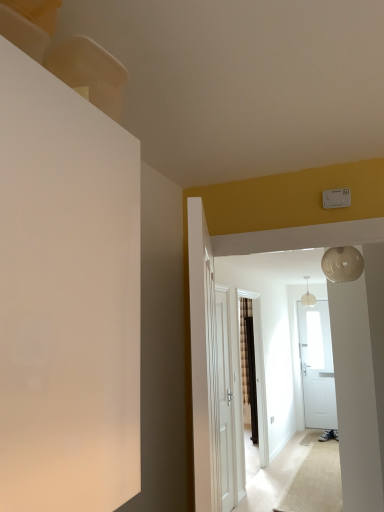
This screenshot has width=384, height=512. I want to click on white wooden door at center, the second door from the left, so click(x=225, y=400).

Measure the distance between white wooden door at center, the first door from the front, and camera.

white wooden door at center, the first door from the front, and camera are 11.24 feet apart from each other.

The height and width of the screenshot is (512, 384). Find the location of `pearl white glass globe at upper right`. pearl white glass globe at upper right is located at coordinates (342, 264).

How far apart are white wooden door at center, which ranks as the 1th door in back-to-front order, and pearl white glass globe at upper center?

3.07 meters.

Does white wooden door at center, which ranks as the 1th door in back-to-front order, have a smaller size compared to pearl white glass globe at upper center?

No, white wooden door at center, which ranks as the 1th door in back-to-front order, is not smaller than pearl white glass globe at upper center.

Find the location of a particular element. This screenshot has width=384, height=512. the 2nd door located beneath the pearl white glass globe at upper center (from a real-world perspective) is located at coordinates (225, 400).

From their relative heights in the image, would you say white wooden door at center, which ranks as the 1th door in back-to-front order, is taller or shorter than pearl white glass globe at upper center?

white wooden door at center, which ranks as the 1th door in back-to-front order, is taller than pearl white glass globe at upper center.

Considering the relative sizes of pearl white glass globe at upper right and white wooden door at center, which ranks as the second door in back-to-front order, in the image provided, is pearl white glass globe at upper right shorter than white wooden door at center, which ranks as the second door in back-to-front order,?

Correct, pearl white glass globe at upper right is not as tall as white wooden door at center, which ranks as the second door in back-to-front order.

Considering the relative positions of pearl white glass globe at upper right and white wooden door at center, placed as the second door when sorted from right to left, in the image provided, is pearl white glass globe at upper right to the right of white wooden door at center, placed as the second door when sorted from right to left, from the viewer's perspective?

Correct, you'll find pearl white glass globe at upper right to the right of white wooden door at center, placed as the second door when sorted from right to left.

Does pearl white glass globe at upper right turn towards white wooden door at center, which ranks as the second door in back-to-front order?

No, pearl white glass globe at upper right is not oriented towards white wooden door at center, which ranks as the second door in back-to-front order.

How far apart are pearl white glass globe at upper right and white wooden door at center, placed as the second door when sorted from right to left?

pearl white glass globe at upper right and white wooden door at center, placed as the second door when sorted from right to left, are 5.67 feet apart.

Considering the relative sizes of pearl white glass globe at upper center and white wooden door at center, the 1th door when ordered from left to right, in the image provided, is pearl white glass globe at upper center wider than white wooden door at center, the 1th door when ordered from left to right,?

Incorrect, the width of pearl white glass globe at upper center does not surpass that of white wooden door at center, the 1th door when ordered from left to right.

Is pearl white glass globe at upper center bigger than white wooden door at center, placed as the second door when sorted from right to left?

Actually, pearl white glass globe at upper center might be smaller than white wooden door at center, placed as the second door when sorted from right to left.

Is pearl white glass globe at upper center completely or partially outside of white wooden door at center, the 1th door when ordered from left to right?

Absolutely, pearl white glass globe at upper center is external to white wooden door at center, the 1th door when ordered from left to right.

Is pearl white glass globe at upper center far away from white wooden door at center, which ranks as the second door in back-to-front order?

Indeed, pearl white glass globe at upper center is not near white wooden door at center, which ranks as the second door in back-to-front order.

Does pearl white glass globe at upper center turn towards white wooden door at center, which ranks as the 1th door in back-to-front order?

No.

From a real-world perspective, is pearl white glass globe at upper center above or below white wooden door at center, the 2th door viewed from the front?

From a real-world perspective, pearl white glass globe at upper center is physically above white wooden door at center, the 2th door viewed from the front.

Does pearl white glass globe at upper center touch white wooden door at center, marked as the 1th door in a right-to-left arrangement?

There is a gap between pearl white glass globe at upper center and white wooden door at center, marked as the 1th door in a right-to-left arrangement.

From the image's perspective, which is above, white wooden door at center, placed as the second door when sorted from right to left, or pearl white glass globe at upper right?

pearl white glass globe at upper right, from the image's perspective.

From a real-world perspective, which object rests below the other?

white wooden door at center, the 1th door when ordered from left to right, is physically lower.

Is white wooden door at center, placed as the second door when sorted from right to left, taller or shorter than pearl white glass globe at upper right?

white wooden door at center, placed as the second door when sorted from right to left, is taller than pearl white glass globe at upper right.

What are the coordinates of `lamp located above the white wooden door at center, the first door from the front (from the image's perspective)` in the screenshot? It's located at (342, 264).

Does pearl white glass globe at upper right appear on the right side of pearl white glass globe at upper center?

No.

Can pearl white glass globe at upper center be found inside pearl white glass globe at upper right?

No, pearl white glass globe at upper center is located outside of pearl white glass globe at upper right.

Is pearl white glass globe at upper right wider or thinner than pearl white glass globe at upper center?

In the image, pearl white glass globe at upper right appears to be wider than pearl white glass globe at upper center.

From a real-world perspective, is pearl white glass globe at upper right positioned under pearl white glass globe at upper center based on gravity?

Yes, from a real-world perspective, pearl white glass globe at upper right is below pearl white glass globe at upper center.

Does pearl white glass globe at upper center have a lesser width compared to pearl white glass globe at upper right?

Indeed, pearl white glass globe at upper center has a lesser width compared to pearl white glass globe at upper right.

Can you confirm if pearl white glass globe at upper center is positioned to the right of pearl white glass globe at upper right?

Yes, pearl white glass globe at upper center is to the right of pearl white glass globe at upper right.

Is pearl white glass globe at upper center placed right next to pearl white glass globe at upper right?

pearl white glass globe at upper center and pearl white glass globe at upper right are clearly separated.

Who is shorter, pearl white glass globe at upper center or pearl white glass globe at upper right?

With less height is pearl white glass globe at upper right.

Where is `light fixture that is above the white wooden door at center, the 2th door viewed from the front (from the image's perspective)`? light fixture that is above the white wooden door at center, the 2th door viewed from the front (from the image's perspective) is located at coordinates (308, 296).

This screenshot has height=512, width=384. In order to click on door that is the 1st one below the pearl white glass globe at upper right (from a real-world perspective) in this screenshot , I will do `click(205, 362)`.

Based on the photo, which object lies further to the anchor point white wooden door at center, the first door from the front, pearl white glass globe at upper center or white wooden door at center, marked as the 1th door in a right-to-left arrangement?

Based on the image, pearl white glass globe at upper center appears to be further to white wooden door at center, the first door from the front.

When comparing their distances from pearl white glass globe at upper center, does pearl white glass globe at upper right or white wooden door at center, marked as the 1th door in a right-to-left arrangement, seem closer?

white wooden door at center, marked as the 1th door in a right-to-left arrangement.

From the image, which object appears to be farther from white wooden door at center, marked as the 1th door in a right-to-left arrangement, white wooden door at center, which ranks as the second door in back-to-front order, or pearl white glass globe at upper right?

pearl white glass globe at upper right is further to white wooden door at center, marked as the 1th door in a right-to-left arrangement.

Based on their spatial positions, is pearl white glass globe at upper center or white wooden door at center, which ranks as the 1th door in back-to-front order, closer to pearl white glass globe at upper right?

white wooden door at center, which ranks as the 1th door in back-to-front order, is closer to pearl white glass globe at upper right.

Based on their spatial positions, is white wooden door at center, the first door from the front, or white wooden door at center, marked as the 1th door in a right-to-left arrangement, closer to pearl white glass globe at upper center?

The object closer to pearl white glass globe at upper center is white wooden door at center, marked as the 1th door in a right-to-left arrangement.

Which object lies further to the anchor point pearl white glass globe at upper right, white wooden door at center, the 2th door viewed from the front, or pearl white glass globe at upper center?

Based on the image, pearl white glass globe at upper center appears to be further to pearl white glass globe at upper right.

Estimate the real-world distances between objects in this image. Which object is closer to white wooden door at center, the second door from the left, pearl white glass globe at upper right or pearl white glass globe at upper center?

pearl white glass globe at upper right.

From the picture: When comparing their distances from white wooden door at center, marked as the 1th door in a right-to-left arrangement, does pearl white glass globe at upper right or white wooden door at center, the 1th door when ordered from left to right, seem further?

Based on the image, pearl white glass globe at upper right appears to be further to white wooden door at center, marked as the 1th door in a right-to-left arrangement.

The image size is (384, 512). I want to click on door between pearl white glass globe at upper right and pearl white glass globe at upper center from front to back, so click(x=225, y=400).

Identify the location of lamp located between white wooden door at center, the first door from the front, and white wooden door at center, the 2th door viewed from the front, in the depth direction. (342, 264).

I want to click on lamp between white wooden door at center, the 1th door when ordered from left to right, and pearl white glass globe at upper center from front to back, so click(342, 264).

Image resolution: width=384 pixels, height=512 pixels. In order to click on door positioned between white wooden door at center, the first door from the front, and pearl white glass globe at upper center from near to far in this screenshot , I will do `click(225, 400)`.